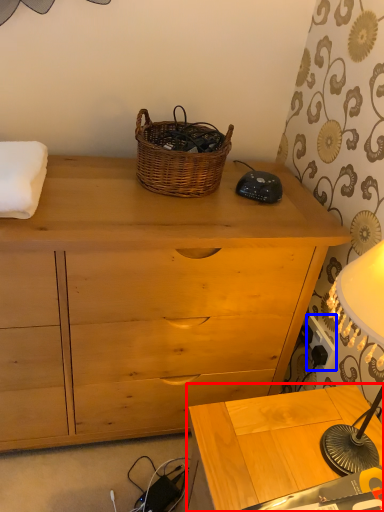
Question: Among these objects, which one is farthest to the camera, table (highlighted by a red box) or power outlet (highlighted by a blue box)?

Choices:
 (A) table
 (B) power outlet

Answer: (B)